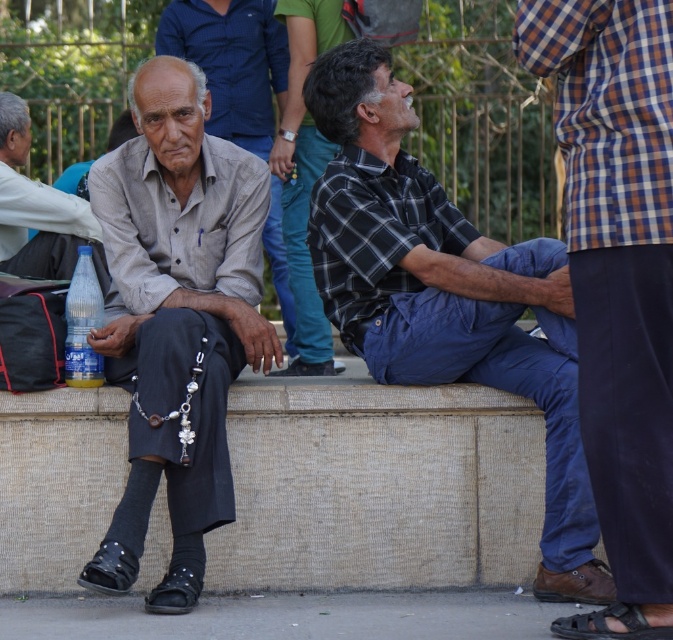
Looking at this image, you are a photographer trying to capture a closeup of the translucent plastic bottle at lower left without including the black leather sandal at lower right in the frame. Is this possible based on their positions?

The translucent plastic bottle at lower left is positioned over the black leather sandal at lower right, so it is not possible to capture a closeup of the bottle without including the sandal in the frame.

You are standing at the point marked as point (250,72) in the street scene. If you want to walk towards the viewer, which direction should you go?

Since point (250,72) is 9.33 meters away from the viewer, you should walk towards the viewer by moving in the direction facing away from the point, which would be towards the viewer.

You are a photographer trying to capture a closeup shot of the translucent plastic bottle at lower left without the gray fabric shirt at left blocking the view. Can you determine if the shirt is wider than the bottle?

The gray fabric shirt at left is wider than the translucent plastic bottle at lower left, so it might block the view.